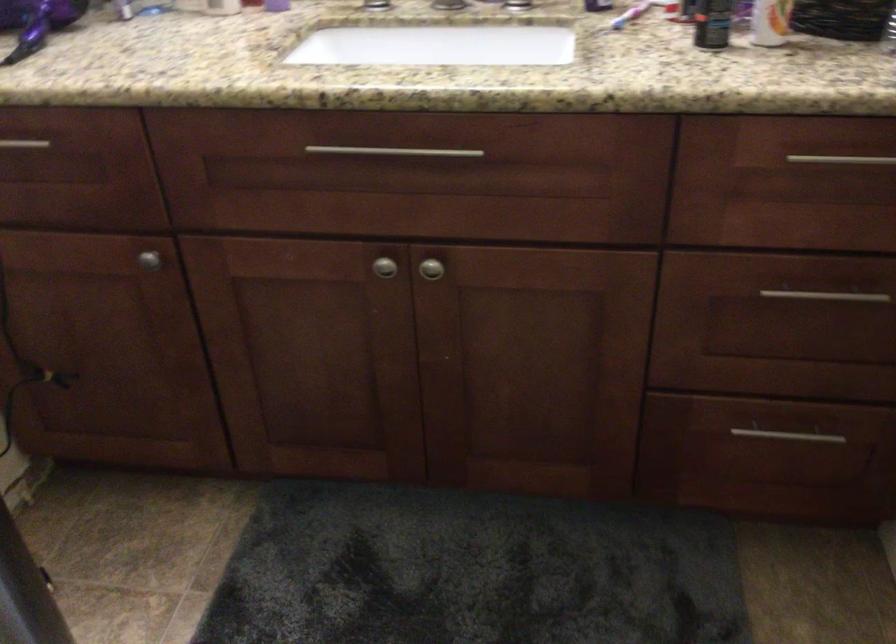
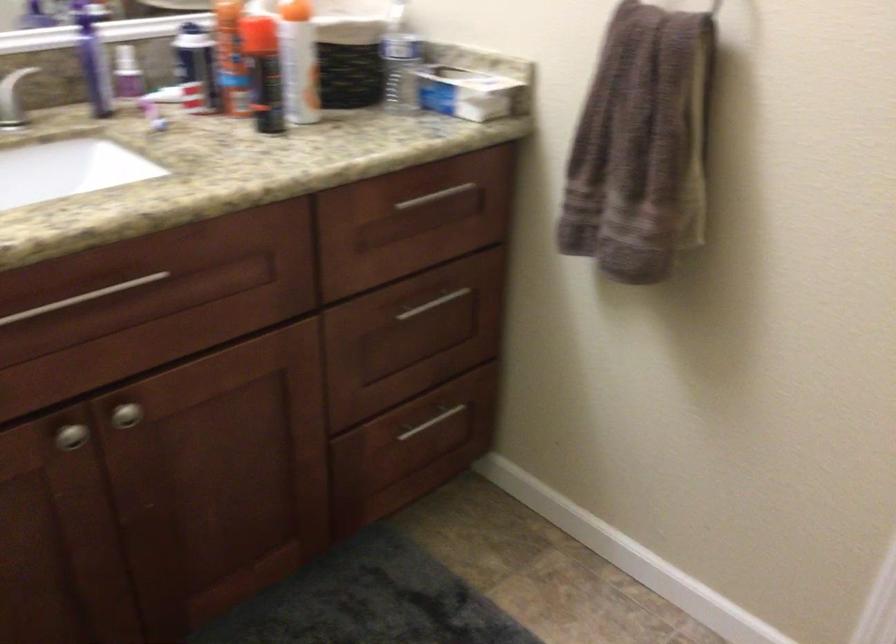
In the second image, find the point that corresponds to point (383, 267) in the first image.

(71, 436)